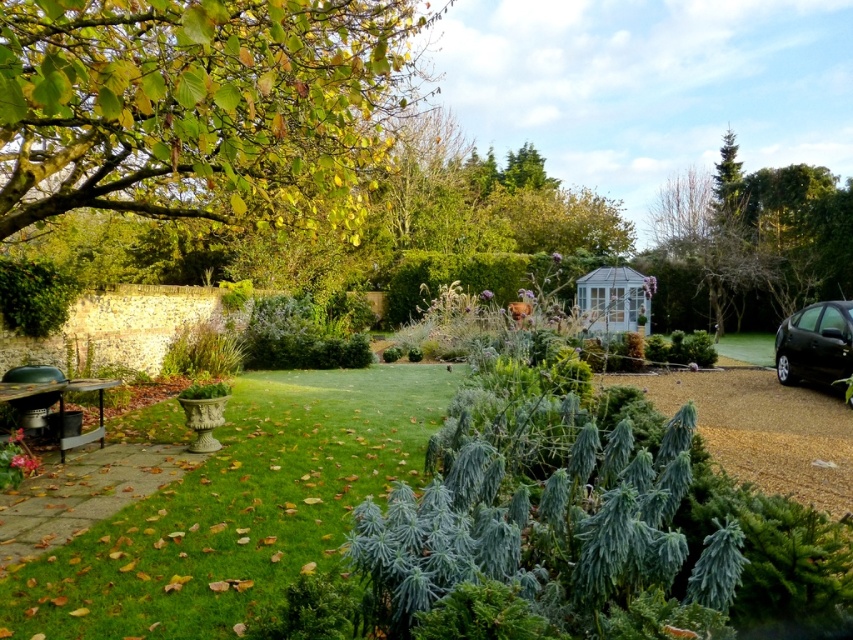
Can you confirm if green grass at lower left is positioned below black metallic car at right?

Correct, green grass at lower left is located below black metallic car at right.

Find the location of a particular element. green grass at lower left is located at coordinates (238, 508).

Does green leafy tree at upper left appear on the left side of black metallic car at right?

Yes, green leafy tree at upper left is to the left of black metallic car at right.

Does green leafy tree at upper left have a lesser height compared to black metallic car at right?

In fact, green leafy tree at upper left may be taller than black metallic car at right.

Who is more forward, (x=102, y=3) or (x=834, y=310)?

Point (x=102, y=3) is in front.

Locate an element on the screen. The height and width of the screenshot is (640, 853). green leafy tree at upper left is located at coordinates (200, 106).

Is green leafy tree at upper left shorter than green grass at lower left?

No, green leafy tree at upper left is not shorter than green grass at lower left.

Who is more forward, (115, 83) or (325, 456)?

Point (115, 83)

Where is `green leafy tree at upper left`? The width and height of the screenshot is (853, 640). green leafy tree at upper left is located at coordinates (200, 106).